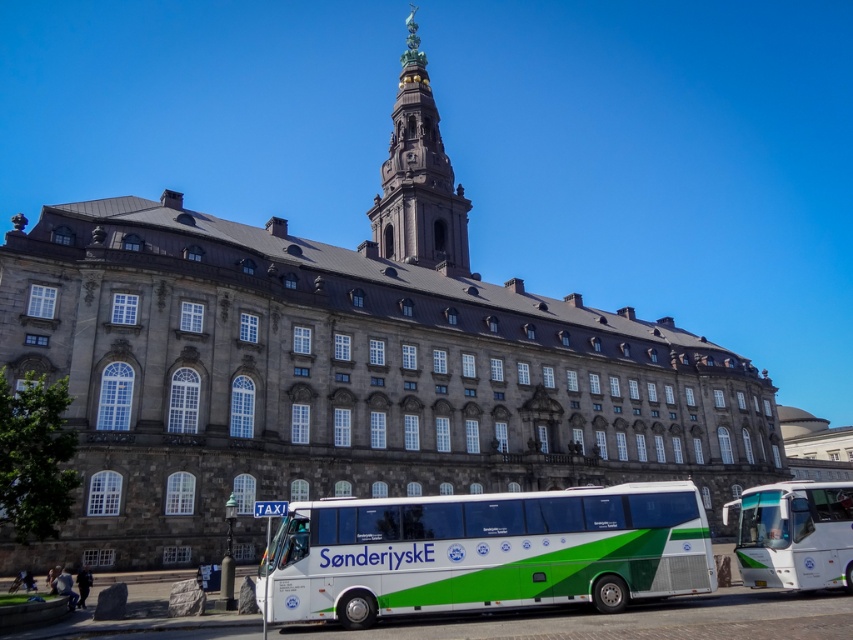
You are standing on the sidewalk in front of the historic building and want to take a photo of the bus. You notice two points marked on the bus. Which point, point 1 at coordinates (x=386, y=552) or point 2 at (x=387, y=228), is closer to you when you take the photo?

Point 1 at coordinates (x=386, y=552) is closer to you than point 2 at (x=387, y=228) because it is positioned nearer to the viewer according to the description.